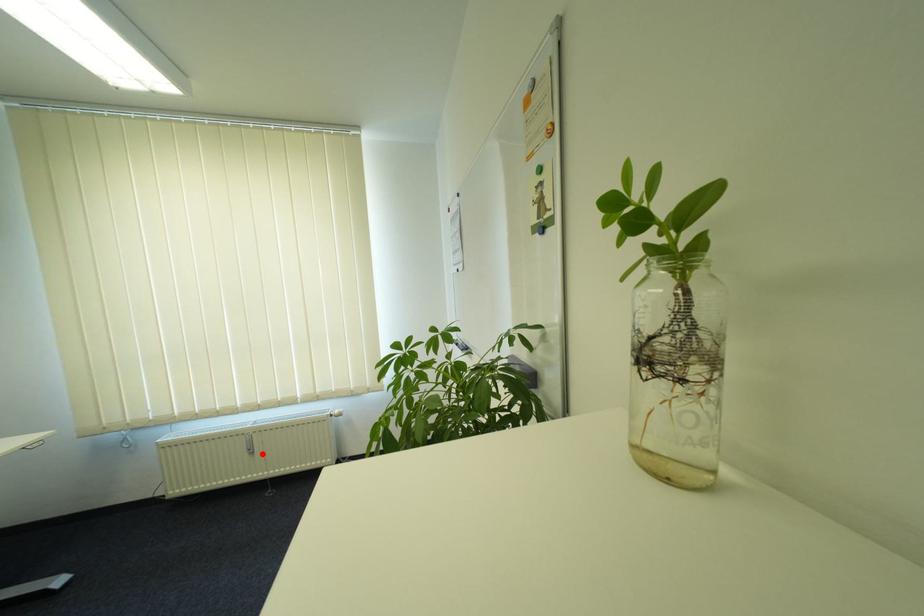
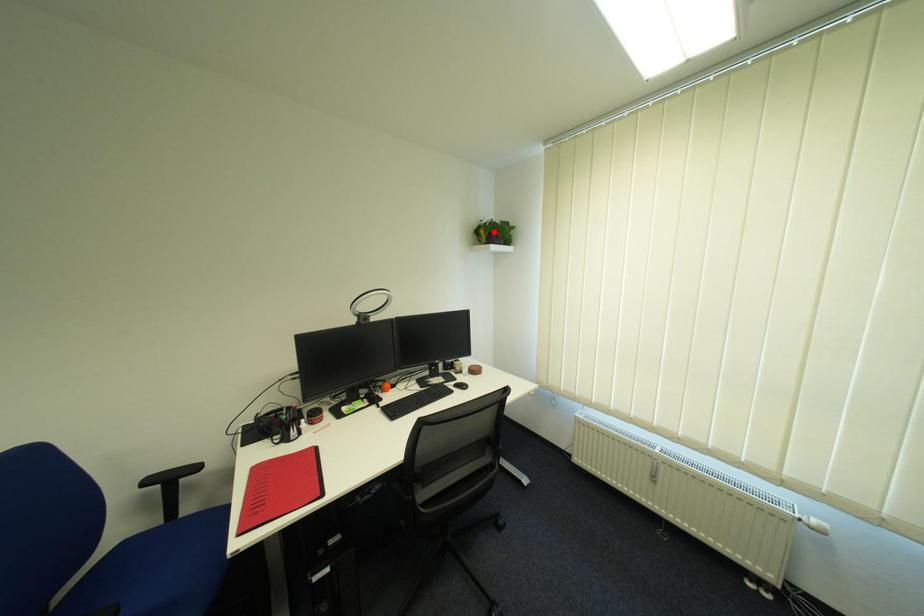
I am providing you with two images of the same scene from different viewpoints. A red point is marked on the first image and another point is marked on the second image. Does the point marked in image1 correspond to the same location as the one in image2?

No